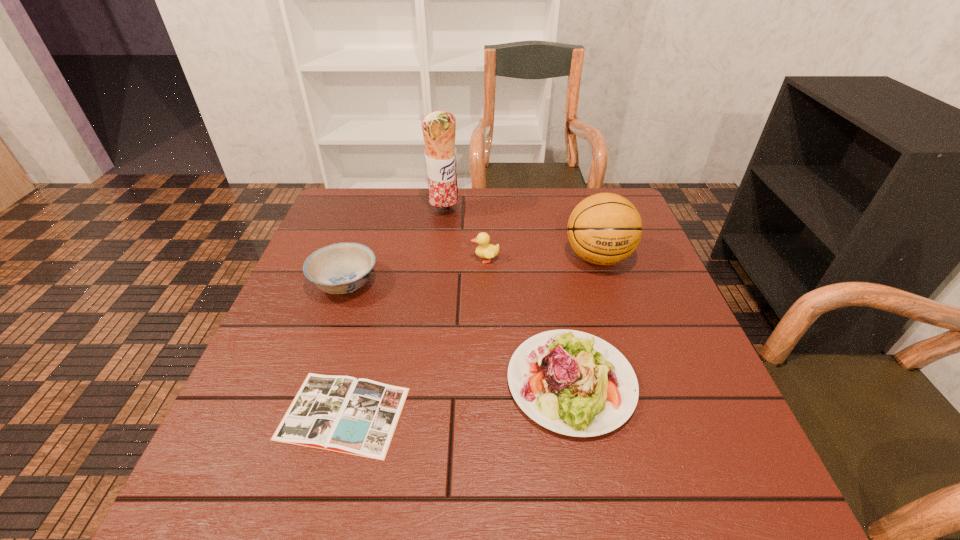
Locate an element on the screen. The width and height of the screenshot is (960, 540). vacant space situated on the front-facing side of the third tallest object is located at coordinates (342, 259).

Where is `vacant area situated 0.380m on the front-facing side of the third tallest object`? This screenshot has width=960, height=540. vacant area situated 0.380m on the front-facing side of the third tallest object is located at coordinates (326, 259).

You are a GUI agent. You are given a task and a screenshot of the screen. Output one action in this format:
    pyautogui.click(x=<x>, y=<y>)
    Task: Click on the vacant area situated 0.310m on the front-facing side of the third tallest object
    The height and width of the screenshot is (540, 960).
    Given the screenshot: What is the action you would take?
    pyautogui.click(x=353, y=259)

This screenshot has height=540, width=960. What are the coordinates of `free space located on the right of the third shortest object` in the screenshot? It's located at (517, 283).

I want to click on blank space located 0.100m on the right of the second shortest object, so click(685, 382).

Locate an element on the screen. free spot located 0.310m on the back of the book is located at coordinates (380, 273).

You are a GUI agent. You are given a task and a screenshot of the screen. Output one action in this format:
    pyautogui.click(x=<x>, y=<y>)
    Task: Click on the object at the far edge
    This screenshot has width=960, height=540.
    Given the screenshot: What is the action you would take?
    pyautogui.click(x=439, y=127)

This screenshot has height=540, width=960. Identify the location of bowl situated at the left edge. click(x=341, y=268).

Locate an element on the screen. This screenshot has height=540, width=960. book positioned at the left edge is located at coordinates (338, 413).

The height and width of the screenshot is (540, 960). Identify the location of basketball that is at the right edge. (604, 229).